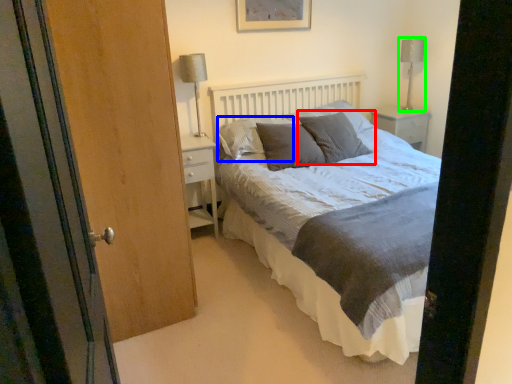
Question: Which is nearer to the pillow (highlighted by a red box)? pillow (highlighted by a blue box) or table lamp (highlighted by a green box).

Choices:
 (A) pillow
 (B) table lamp

Answer: (A)